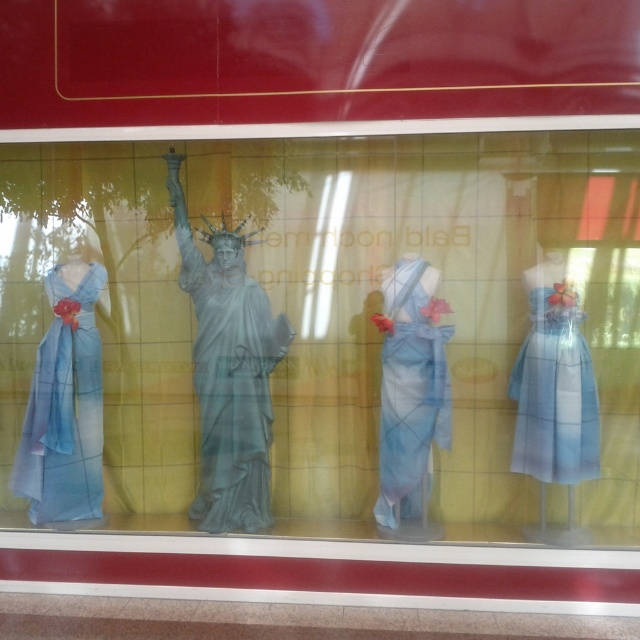
Question: Considering the real-world distances, which object is farthest from the matte blue dress at left?

Choices:
 (A) matte blue statue at center
 (B) light blue sheer dress at right
 (C) matte blue fabric dress at center
 (D) bronze statue at center

Answer: (B)

Question: Is matte blue statue at center further to the viewer compared to light blue sheer dress at right?

Choices:
 (A) no
 (B) yes

Answer: (A)

Question: Is bronze statue at center to the left of matte blue dress at left from the viewer's perspective?

Choices:
 (A) yes
 (B) no

Answer: (B)

Question: Which point is closer to the camera?

Choices:
 (A) matte blue fabric dress at center
 (B) bronze statue at center
 (C) matte blue dress at left
 (D) light blue sheer dress at right

Answer: (D)

Question: Can you confirm if matte blue statue at center is wider than light blue sheer dress at right?

Choices:
 (A) yes
 (B) no

Answer: (A)

Question: Among these points, which one is nearest to the camera?

Choices:
 (A) (568, 339)
 (B) (259, 394)
 (C) (428, 141)

Answer: (A)